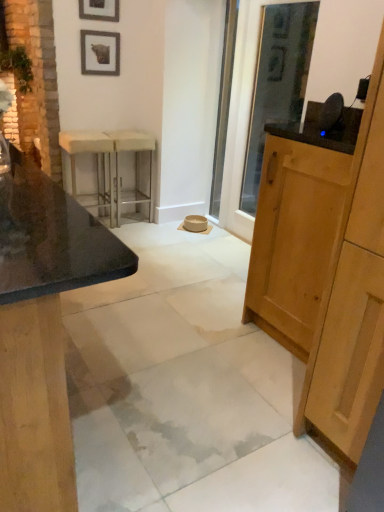
This screenshot has height=512, width=384. What do you see at coordinates (100, 53) in the screenshot? I see `wooden picture frame at upper center, the 1th picture frame from the bottom` at bounding box center [100, 53].

You are a GUI agent. You are given a task and a screenshot of the screen. Output one action in this format:
    pyautogui.click(x=<x>, y=<y>)
    Task: Click on the metallic silver bar stool at center
    Image resolution: width=384 pixels, height=512 pixels.
    Given the screenshot: What is the action you would take?
    pyautogui.click(x=135, y=166)

The width and height of the screenshot is (384, 512). Describe the element at coordinates (184, 388) in the screenshot. I see `white marble concrete at center` at that location.

What are the coordinates of `white fabric stool at left` in the screenshot? It's located at (96, 164).

Identify the location of matte stone barstools at left, arranged as the first cabinetry when viewed from the left. The width and height of the screenshot is (384, 512). (42, 330).

You are a GUI agent. You are given a task and a screenshot of the screen. Output one action in this format:
    pyautogui.click(x=<x>, y=<y>)
    Task: Click on the wooden picture frame at upper center, the 1th picture frame from the bottom
    
    Given the screenshot: What is the action you would take?
    pyautogui.click(x=100, y=53)

Considering the positions of points (117, 47) and (295, 200), is point (117, 47) farther from camera compared to point (295, 200)?

That is True.

Which of these two, wooden picture frame at upper center, the 2th picture frame from the top, or light brown wood cabinet at right, marked as the second cabinetry in a left-to-right arrangement, is bigger?

light brown wood cabinet at right, marked as the second cabinetry in a left-to-right arrangement, is bigger.

Which is behind, point (10, 262) or point (231, 78)?

The point (231, 78) is farther from the camera.

Relative to clear glass screen door at center, is matte stone barstools at left, arranged as the first cabinetry when viewed from the left, in front or behind?

matte stone barstools at left, arranged as the first cabinetry when viewed from the left, is in front of clear glass screen door at center.

Considering the sizes of objects matte stone barstools at left, arranged as the first cabinetry when viewed from the left, and clear glass screen door at center in the image provided, who is shorter, matte stone barstools at left, arranged as the first cabinetry when viewed from the left, or clear glass screen door at center?

matte stone barstools at left, arranged as the first cabinetry when viewed from the left.

How distant is matte stone barstools at left, arranged as the first cabinetry when viewed from the left, from clear glass screen door at center?

The distance of matte stone barstools at left, arranged as the first cabinetry when viewed from the left, from clear glass screen door at center is 2.58 meters.

Is white fabric stool at left shorter than white marble concrete at center?

Incorrect, the height of white fabric stool at left does not fall short of that of white marble concrete at center.

Is white fabric stool at left oriented towards white marble concrete at center?

Yes, white fabric stool at left faces towards white marble concrete at center.

Is white fabric stool at left directly adjacent to white marble concrete at center?

They are not placed beside each other.

Where is `cabinetry above the matte stone barstools at left, which is counted as the second cabinetry, starting from the right (from the image's perspective)`? Image resolution: width=384 pixels, height=512 pixels. cabinetry above the matte stone barstools at left, which is counted as the second cabinetry, starting from the right (from the image's perspective) is located at coordinates (294, 237).

Looking at this image, does matte stone barstools at left, which is counted as the second cabinetry, starting from the right, turn towards light brown wood cabinet at right, marked as the second cabinetry in a left-to-right arrangement?

Yes.

Which object is positioned more to the left, matte stone barstools at left, which is counted as the second cabinetry, starting from the right, or light brown wood cabinet at right, marked as the second cabinetry in a left-to-right arrangement?

matte stone barstools at left, which is counted as the second cabinetry, starting from the right.

Consider the image. Does wooden picture frame at upper center, the 1th picture frame from the bottom, appear on the right side of white fabric stool at left?

Yes.

In the scene shown: Is wooden picture frame at upper center, the 2th picture frame from the top, not near white fabric stool at left?

No.

Which object is further away from the camera, wooden picture frame at upper center, the 1th picture frame from the bottom, or white fabric stool at left?

wooden picture frame at upper center, the 1th picture frame from the bottom.

Is wooden picture frame at upper center, the 2th picture frame from the top, oriented away from white fabric stool at left?

No, wooden picture frame at upper center, the 2th picture frame from the top, is not facing the opposite direction of white fabric stool at left.

From the image's perspective, is white fabric stool at left above or below matte black picture frame at upper left, marked as the 1th picture frame in a top-to-bottom arrangement?

From the image's perspective, white fabric stool at left appears below matte black picture frame at upper left, marked as the 1th picture frame in a top-to-bottom arrangement.

Is white fabric stool at left touching matte black picture frame at upper left, marked as the 1th picture frame in a top-to-bottom arrangement?

No, white fabric stool at left is not making contact with matte black picture frame at upper left, marked as the 1th picture frame in a top-to-bottom arrangement.

Which of these two, white fabric stool at left or matte black picture frame at upper left, marked as the 1th picture frame in a top-to-bottom arrangement, is bigger?

Bigger between the two is white fabric stool at left.

Consider the image. Who is smaller, metallic silver bar stool at center or matte stone barstools at left, arranged as the first cabinetry when viewed from the left?

With smaller size is metallic silver bar stool at center.

Which of these two, metallic silver bar stool at center or matte stone barstools at left, which is counted as the second cabinetry, starting from the right, stands shorter?

With less height is metallic silver bar stool at center.

Is the depth of metallic silver bar stool at center less than that of matte stone barstools at left, arranged as the first cabinetry when viewed from the left?

No, metallic silver bar stool at center is behind matte stone barstools at left, arranged as the first cabinetry when viewed from the left.

Could you tell me if metallic silver bar stool at center is facing matte stone barstools at left, arranged as the first cabinetry when viewed from the left?

No, metallic silver bar stool at center is not aimed at matte stone barstools at left, arranged as the first cabinetry when viewed from the left.

From the image's perspective, count 1st cabinetrys downward from the wooden picture frame at upper center, the 2th picture frame from the top, and point to it. Please provide its 2D coordinates.

[(294, 237)]

Where is `cabinetry that is on the left side of clear glass screen door at center`? The image size is (384, 512). cabinetry that is on the left side of clear glass screen door at center is located at coordinates click(42, 330).

Estimate the real-world distances between objects in this image. Which object is further from metallic silver bar stool at center, matte stone barstools at left, which is counted as the second cabinetry, starting from the right, or white fabric stool at left?

Among the two, matte stone barstools at left, which is counted as the second cabinetry, starting from the right, is located further to metallic silver bar stool at center.

Which object lies further to the anchor point matte stone barstools at left, which is counted as the second cabinetry, starting from the right, white marble concrete at center or metallic silver bar stool at center?

metallic silver bar stool at center is further to matte stone barstools at left, which is counted as the second cabinetry, starting from the right.

When comparing their distances from white fabric stool at left, does matte black picture frame at upper left, marked as the 2th picture frame in a bottom-to-top arrangement, or white marble concrete at center seem further?

Based on the image, white marble concrete at center appears to be further to white fabric stool at left.

Which object lies further to the anchor point light brown wood cabinet at right, marked as the second cabinetry in a left-to-right arrangement, metallic silver bar stool at center or wooden picture frame at upper center, the 1th picture frame from the bottom?

wooden picture frame at upper center, the 1th picture frame from the bottom, is positioned further to the anchor light brown wood cabinet at right, marked as the second cabinetry in a left-to-right arrangement.

Estimate the real-world distances between objects in this image. Which object is further from wooden picture frame at upper center, the 1th picture frame from the bottom, clear glass screen door at center or white marble concrete at center?

white marble concrete at center is positioned further to the anchor wooden picture frame at upper center, the 1th picture frame from the bottom.

Based on their spatial positions, is white fabric stool at left or clear glass screen door at center further from white marble concrete at center?

Among the two, clear glass screen door at center is located further to white marble concrete at center.

Estimate the real-world distances between objects in this image. Which object is further from light brown wood cabinet at right, the first cabinetry when ordered from right to left, wooden picture frame at upper center, the 2th picture frame from the top, or matte stone barstools at left, which is counted as the second cabinetry, starting from the right?

wooden picture frame at upper center, the 2th picture frame from the top, is positioned further to the anchor light brown wood cabinet at right, the first cabinetry when ordered from right to left.

When comparing their distances from matte stone barstools at left, which is counted as the second cabinetry, starting from the right, does white marble concrete at center or wooden picture frame at upper center, the 1th picture frame from the bottom, seem further?

Based on the image, wooden picture frame at upper center, the 1th picture frame from the bottom, appears to be further to matte stone barstools at left, which is counted as the second cabinetry, starting from the right.

You are a GUI agent. You are given a task and a screenshot of the screen. Output one action in this format:
    pyautogui.click(x=<x>, y=<y>)
    Task: Click on the screen door between matte stone barstools at left, which is counted as the second cabinetry, starting from the right, and white fabric stool at left in the front-back direction
    The image size is (384, 512).
    Given the screenshot: What is the action you would take?
    pyautogui.click(x=223, y=104)

The image size is (384, 512). What are the coordinates of `screen door positioned between matte stone barstools at left, which is counted as the second cabinetry, starting from the right, and metallic silver bar stool at center from near to far` in the screenshot? It's located at (223, 104).

Find the location of a particular element. cabinetry between matte stone barstools at left, arranged as the first cabinetry when viewed from the left, and wooden picture frame at upper center, the 2th picture frame from the top, along the z-axis is located at coordinates (294, 237).

Where is `concrete between matte stone barstools at left, which is counted as the second cabinetry, starting from the right, and metallic silver bar stool at center in the front-back direction`? concrete between matte stone barstools at left, which is counted as the second cabinetry, starting from the right, and metallic silver bar stool at center in the front-back direction is located at coordinates (184, 388).